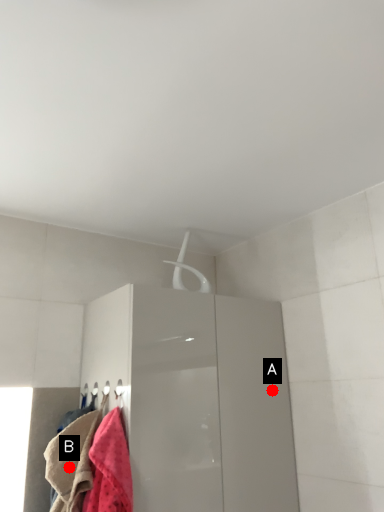
Question: Two points are circled on the image, labeled by A and B beside each circle. Which point is closer to the camera?

Choices:
 (A) A is closer
 (B) B is closer

Answer: (B)